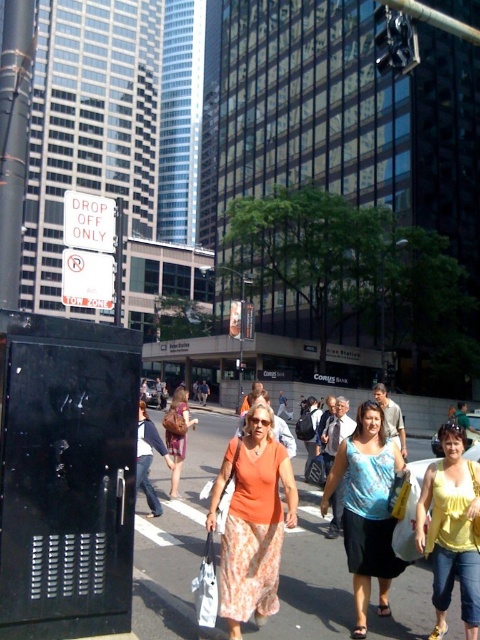
You are a fashion designer observing the urban scene. You notice a point of interest at coordinates (391, 417). What clothing item is located at this point?

The point at (391, 417) corresponds to the matte orange tank top at center.

You are a fashion designer observing the urban street scene. You notice the white fabric bag at center and the denim shorts at center. Which item is shorter in height?

The white fabric bag at center is shorter than the denim shorts at center.

You are a photographer aiming to capture both the matte orange tank top at center and the orange fabric dress at center in a single frame. Which of the two orange items is located to the left in the image?

The orange fabric dress at center is located to the left of the matte orange tank top at center.